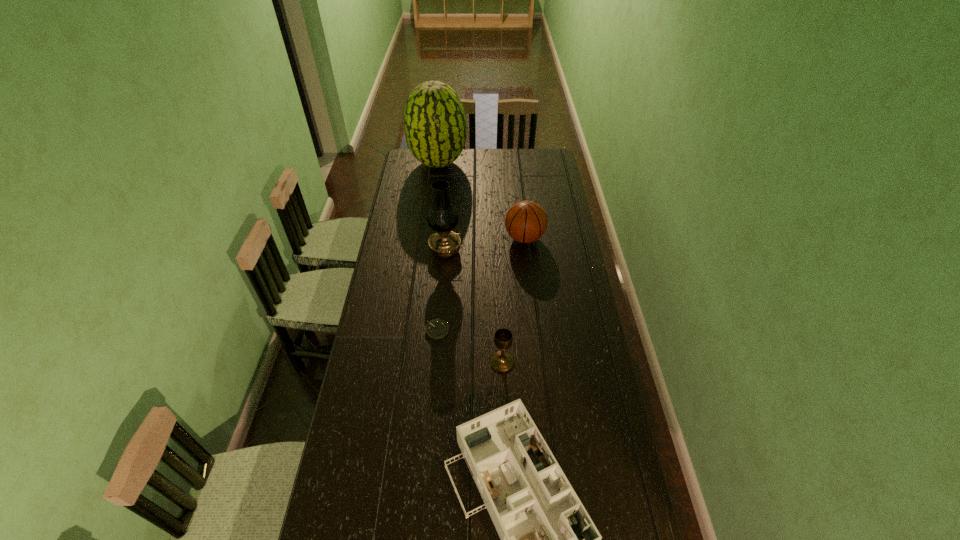
Locate an element on the screen. This screenshot has height=540, width=960. free location that satisfies the following two spatial constraints: 1. on the front side of the tallest object; 2. on the left side of the fourth shortest object is located at coordinates (429, 238).

I want to click on vacant space that satisfies the following two spatial constraints: 1. on the back side of the basketball; 2. on the left side of the third nearest object, so click(444, 238).